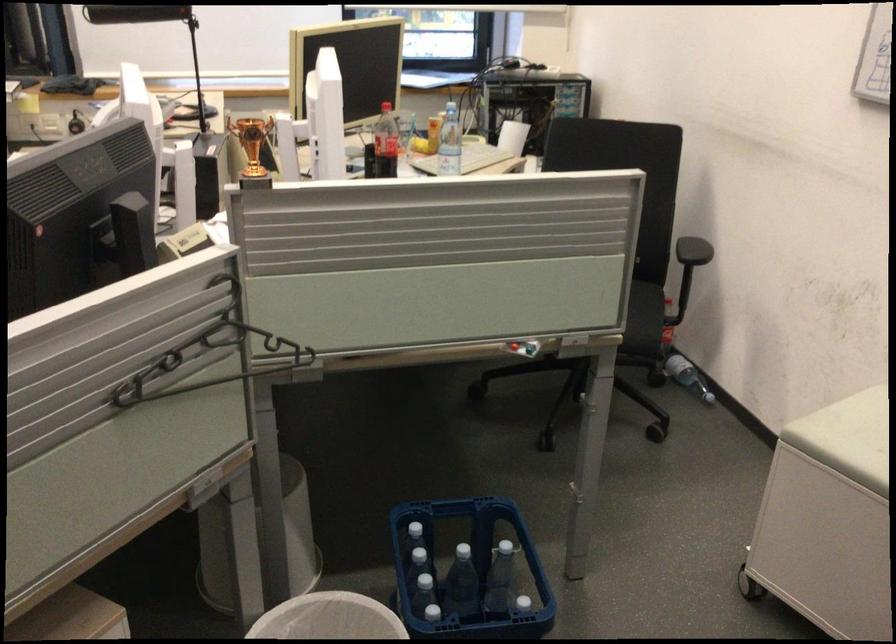
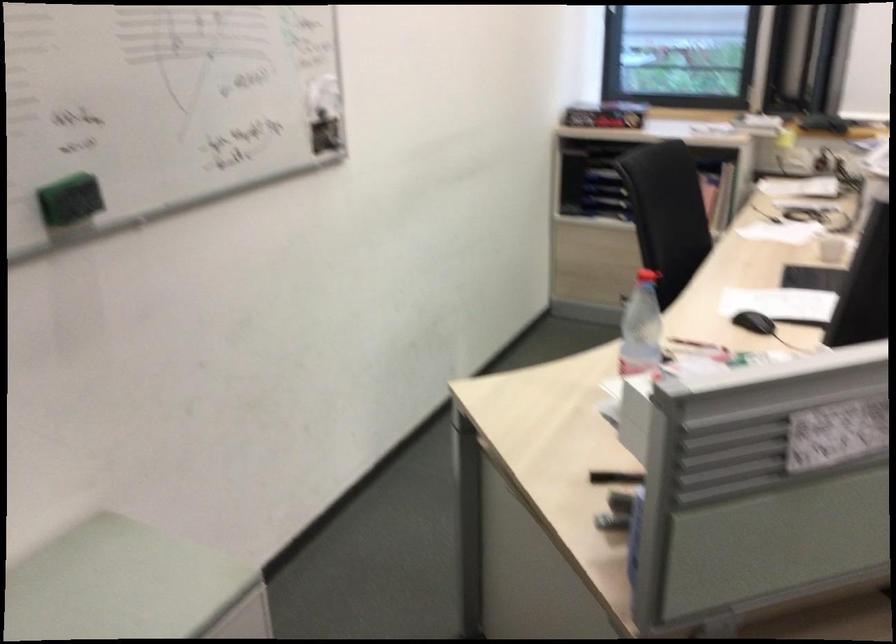
Question: The camera is either moving clockwise (left) or counter-clockwise (right) around the object. The first image is from the beginning of the video and the second image is from the end. Is the camera moving left or right when shooting the video?

Choices:
 (A) Left
 (B) Right

Answer: (B)